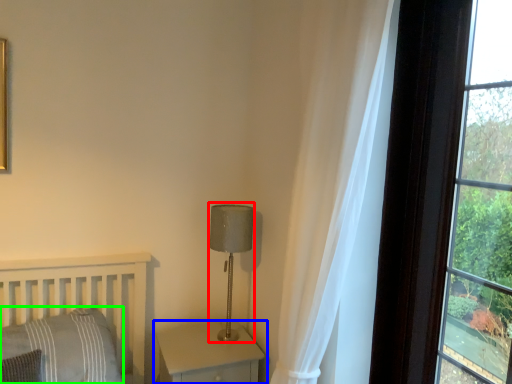
Question: Considering the real-world distances, which object is farthest from table lamp (highlighted by a red box)? nightstand (highlighted by a blue box) or pillow (highlighted by a green box)?

Choices:
 (A) nightstand
 (B) pillow

Answer: (B)